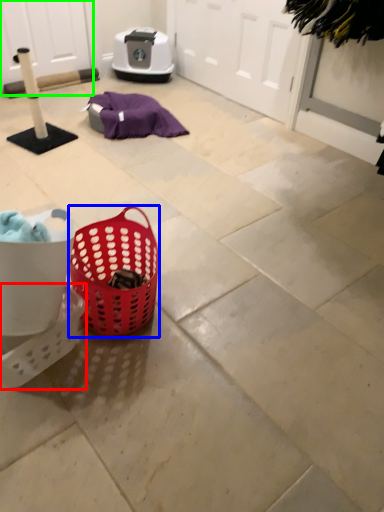
Question: Which object is the farthest from basket (highlighted by a red box)? Choose among these: picnic basket (highlighted by a blue box) or screen door (highlighted by a green box).

Choices:
 (A) picnic basket
 (B) screen door

Answer: (B)